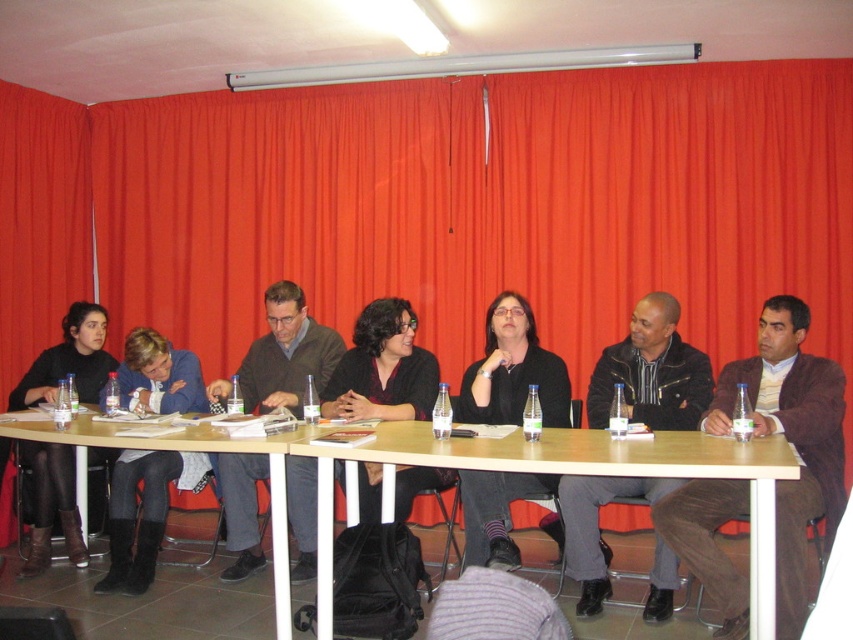
Question: Estimate the real-world distances between objects in this image. Which object is farther from the wooden table at center?

Choices:
 (A) matte black jacket at center
 (B) black matte shirt at center

Answer: (B)

Question: Which is farther from the wooden table at center?

Choices:
 (A) black leather jacket at center
 (B) black leather jacket at lower left
 (C) matte black boots at lower left

Answer: (A)

Question: Does black leather jacket at center appear on the right side of black matte shirt at center?

Choices:
 (A) yes
 (B) no

Answer: (A)

Question: Which point is closer to the camera?

Choices:
 (A) (103, 378)
 (B) (193, 433)
 (C) (126, 408)

Answer: (B)

Question: Does brown leather jacket at center have a greater width compared to wooden table at center?

Choices:
 (A) yes
 (B) no

Answer: (B)

Question: Considering the relative positions of black leather jacket at lower left and matte black jacket at center in the image provided, where is black leather jacket at lower left located with respect to matte black jacket at center?

Choices:
 (A) right
 (B) left

Answer: (B)